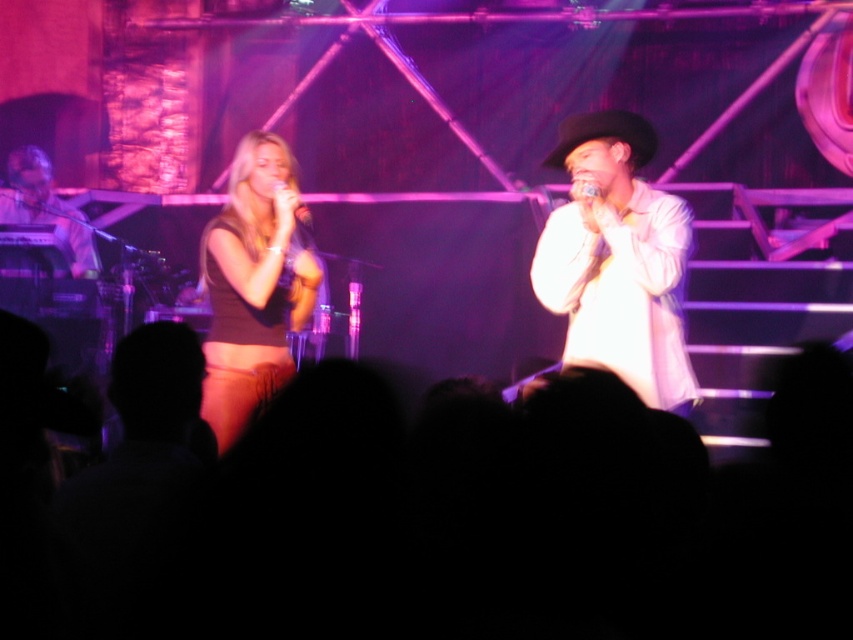
Which is in front, point (656, 243) or point (587, 182)?

Point (656, 243) is in front.

Is white satin shirt at center to the right of metallic silver microphone at upper center from the viewer's perspective?

Correct, you'll find white satin shirt at center to the right of metallic silver microphone at upper center.

Is point (650, 269) farther from viewer compared to point (585, 184)?

No, (650, 269) is in front of (585, 184).

This screenshot has width=853, height=640. I want to click on white satin shirt at center, so click(618, 259).

Is white satin shirt at center positioned at the back of matte black microphone at left?

No, it is in front of matte black microphone at left.

Is white satin shirt at center shorter than matte black microphone at left?

Incorrect, white satin shirt at center's height does not fall short of matte black microphone at left's.

Is point (546, 244) behind point (6, 218)?

No, it is not.

This screenshot has width=853, height=640. I want to click on white satin shirt at center, so click(618, 259).

Looking at this image, is white satin shirt at center bigger than matte black microphone at center?

Yes, white satin shirt at center is bigger than matte black microphone at center.

Who is more distant from viewer, (x=579, y=212) or (x=306, y=211)?

The point (x=306, y=211) is behind.

Does point (566, 268) lie behind point (276, 186)?

No.

Where is `white satin shirt at center`? This screenshot has height=640, width=853. white satin shirt at center is located at coordinates (618, 259).